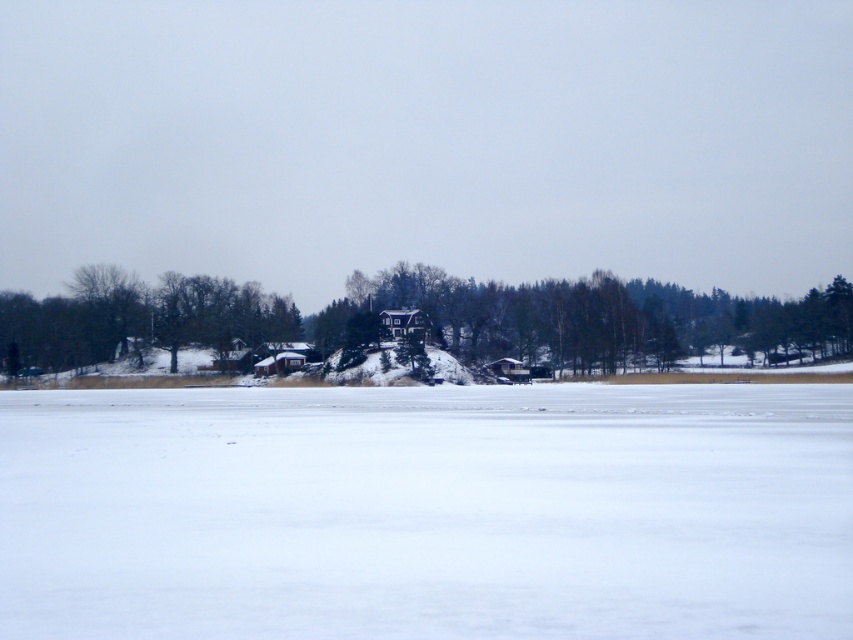
Question: Does white matte snow at center appear on the left side of green matte tree at center?

Choices:
 (A) no
 (B) yes

Answer: (B)

Question: Which object is closer to the camera taking this photo?

Choices:
 (A) green matte tree at center
 (B) white matte snow at center

Answer: (B)

Question: Can you confirm if white matte snow at center is positioned to the right of green matte tree at center?

Choices:
 (A) yes
 (B) no

Answer: (B)

Question: Which point is farther to the camera?

Choices:
 (A) green matte tree at center
 (B) white matte snow at center

Answer: (A)

Question: Does white matte snow at center appear on the left side of green matte tree at center?

Choices:
 (A) yes
 (B) no

Answer: (A)